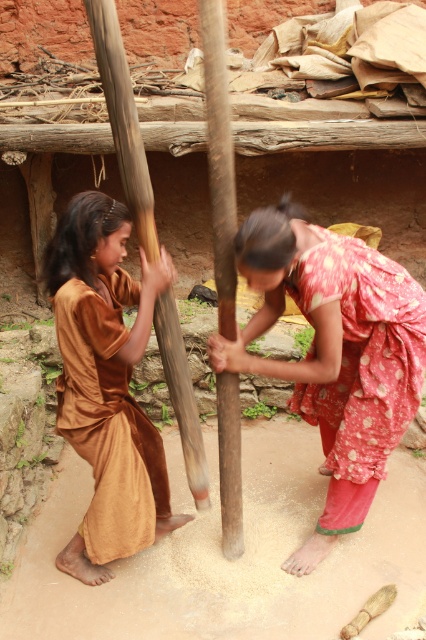
Does brown velvet dress at left appear on the left side of brown wooden pole at left?

Correct, you'll find brown velvet dress at left to the left of brown wooden pole at left.

Between brown velvet dress at left and brown wooden pole at left, which one has less height?

brown velvet dress at left

The image size is (426, 640). I want to click on brown velvet dress at left, so click(x=106, y=384).

The image size is (426, 640). What are the coordinates of `polka dot fabric at center` in the screenshot? It's located at (334, 353).

Can you confirm if polka dot fabric at center is wider than brown velvet dress at left?

Indeed, polka dot fabric at center has a greater width compared to brown velvet dress at left.

Is point (370, 326) positioned before point (80, 253)?

No, it is behind (80, 253).

In order to click on polka dot fabric at center in this screenshot , I will do `click(334, 353)`.

In the scene shown: Is polka dot fabric at center below brown wooden pole at left?

Correct, polka dot fabric at center is located below brown wooden pole at left.

Does polka dot fabric at center have a greater width compared to brown wooden pole at left?

Yes, polka dot fabric at center is wider than brown wooden pole at left.

Locate an element on the screen. polka dot fabric at center is located at coordinates (334, 353).